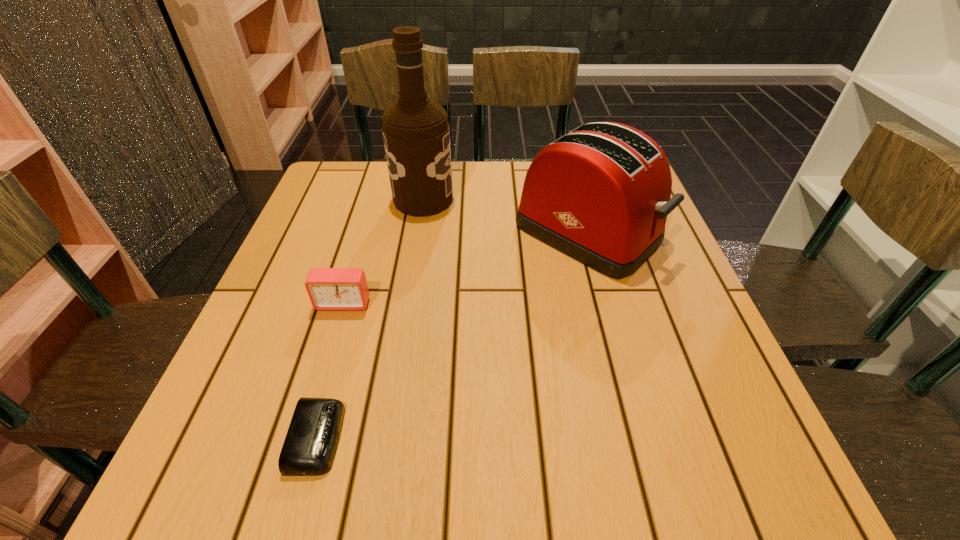
You are a GUI agent. You are given a task and a screenshot of the screen. Output one action in this format:
    pyautogui.click(x=<x>, y=<y>)
    Task: Click on the alcohol
    This screenshot has width=960, height=540.
    Given the screenshot: What is the action you would take?
    pyautogui.click(x=416, y=132)

Image resolution: width=960 pixels, height=540 pixels. I want to click on the second tallest object, so click(x=600, y=194).

Find the location of a particular element. toaster is located at coordinates (600, 194).

Identify the location of the farther alarm clock. The height and width of the screenshot is (540, 960). (328, 288).

Identify the location of the second shortest object. (328, 288).

The width and height of the screenshot is (960, 540). I want to click on the nearer alarm clock, so click(x=310, y=444).

Identify the location of the nearest object. (310, 444).

I want to click on vacant point located on the label of the tallest object, so click(x=563, y=199).

Locate an element on the screen. The width and height of the screenshot is (960, 540). vacant space located on the front of the toaster is located at coordinates (645, 439).

Where is `free space located 0.080m on the front-facing side of the taller alarm clock`? The width and height of the screenshot is (960, 540). free space located 0.080m on the front-facing side of the taller alarm clock is located at coordinates (330, 346).